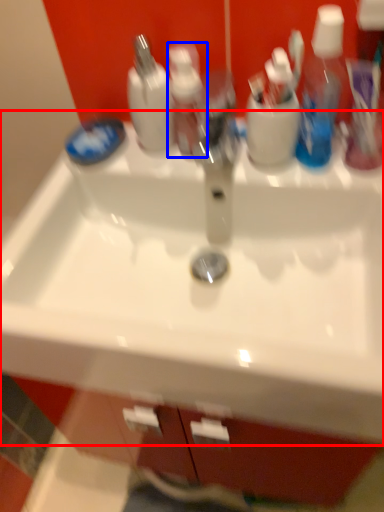
Question: Among these objects, which one is nearest to the camera, sink (highlighted by a red box) or toiletry (highlighted by a blue box)?

Choices:
 (A) sink
 (B) toiletry

Answer: (A)